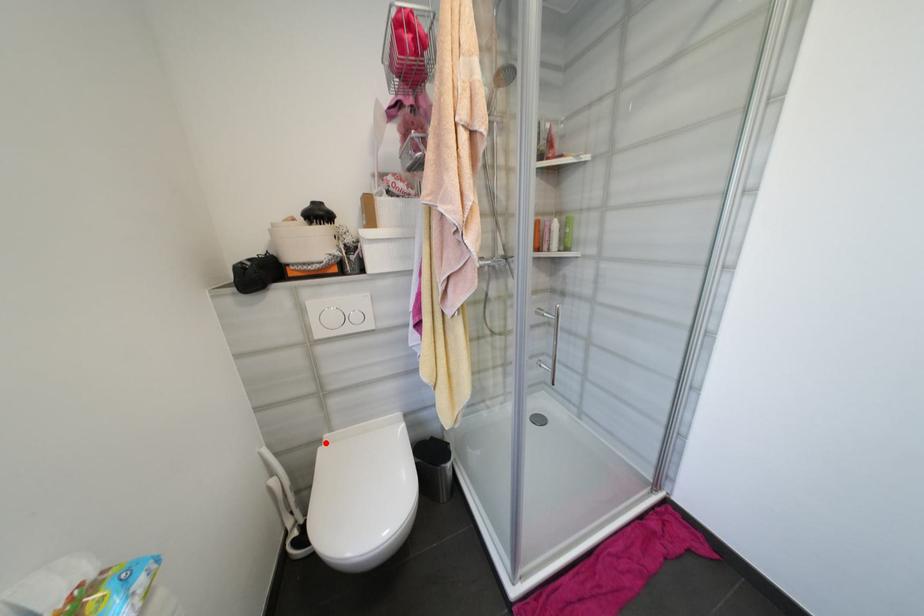
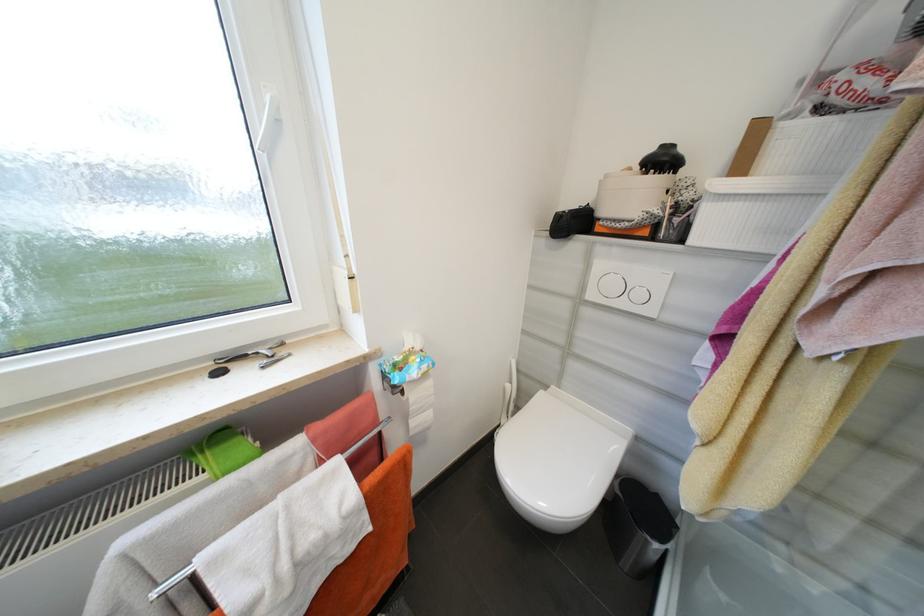
In the second image, find the point that corresponds to the highlighted location in the first image.

(552, 387)